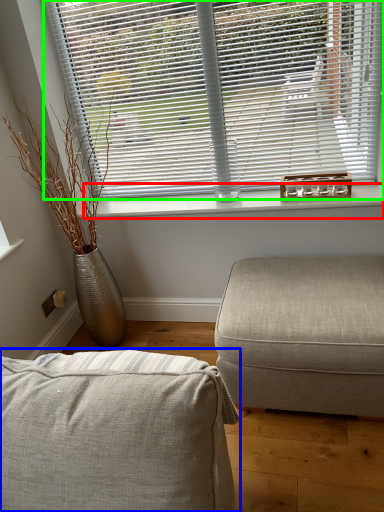
Question: Which object is the farthest from window sill (highlighted by a red box)? Choose among these: studio couch (highlighted by a blue box) or window blind (highlighted by a green box).

Choices:
 (A) studio couch
 (B) window blind

Answer: (A)